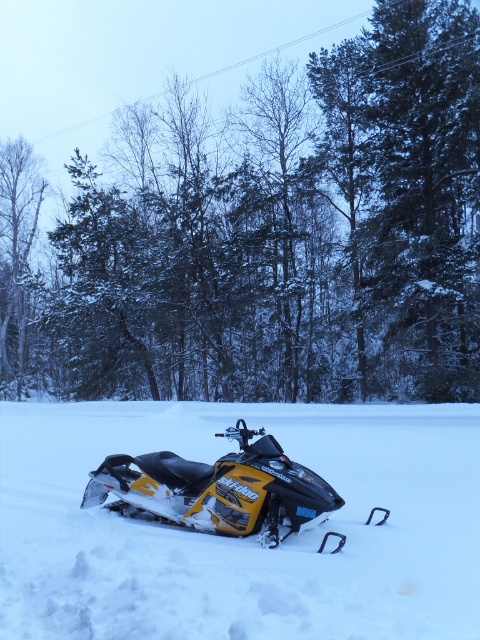
You are planning to take a photo of the yellow matte snowmobile at center and the smooth white tree at left. Which object should you focus on first if you want to capture both in a single frame without moving the camera?

The yellow matte snowmobile at center is shorter than the smooth white tree at left, so you should focus on the smooth white tree at left first to ensure both are in focus.